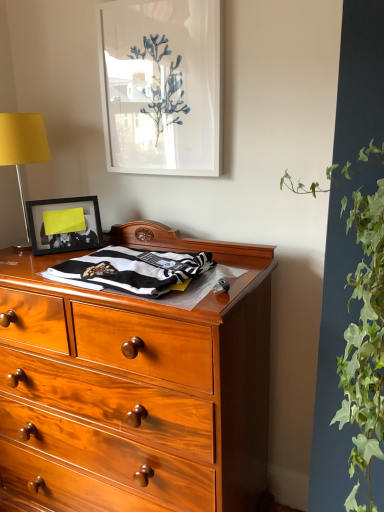
Question: From a real-world perspective, is green leafy plant at right under yellow fabric lampshade at left?

Choices:
 (A) yes
 (B) no

Answer: (A)

Question: Is green leafy plant at right bigger than yellow fabric lampshade at left?

Choices:
 (A) yes
 (B) no

Answer: (A)

Question: Is green leafy plant at right thinner than yellow fabric lampshade at left?

Choices:
 (A) yes
 (B) no

Answer: (B)

Question: Is green leafy plant at right closer to camera compared to yellow fabric lampshade at left?

Choices:
 (A) no
 (B) yes

Answer: (B)

Question: Can you see green leafy plant at right touching yellow fabric lampshade at left?

Choices:
 (A) yes
 (B) no

Answer: (B)

Question: Is yellow fabric lampshade at left located within green leafy plant at right?

Choices:
 (A) yes
 (B) no

Answer: (B)

Question: Considering the relative sizes of yellow fabric lampshade at left and green leafy plant at right in the image provided, is yellow fabric lampshade at left wider than green leafy plant at right?

Choices:
 (A) yes
 (B) no

Answer: (B)

Question: From a real-world perspective, does yellow fabric lampshade at left sit lower than green leafy plant at right?

Choices:
 (A) yes
 (B) no

Answer: (B)

Question: Is yellow fabric lampshade at left taller than green leafy plant at right?

Choices:
 (A) yes
 (B) no

Answer: (B)

Question: From a real-world perspective, is yellow fabric lampshade at left located higher than green leafy plant at right?

Choices:
 (A) yes
 (B) no

Answer: (A)

Question: Can you confirm if yellow fabric lampshade at left is positioned to the left of green leafy plant at right?

Choices:
 (A) no
 (B) yes

Answer: (B)

Question: Is yellow fabric lampshade at left outside of green leafy plant at right?

Choices:
 (A) no
 (B) yes

Answer: (B)

Question: Would you say matte black picture frame at upper left, placed as the 2th picture frame when sorted from top to bottom, contains green leafy plant at right?

Choices:
 (A) no
 (B) yes

Answer: (A)